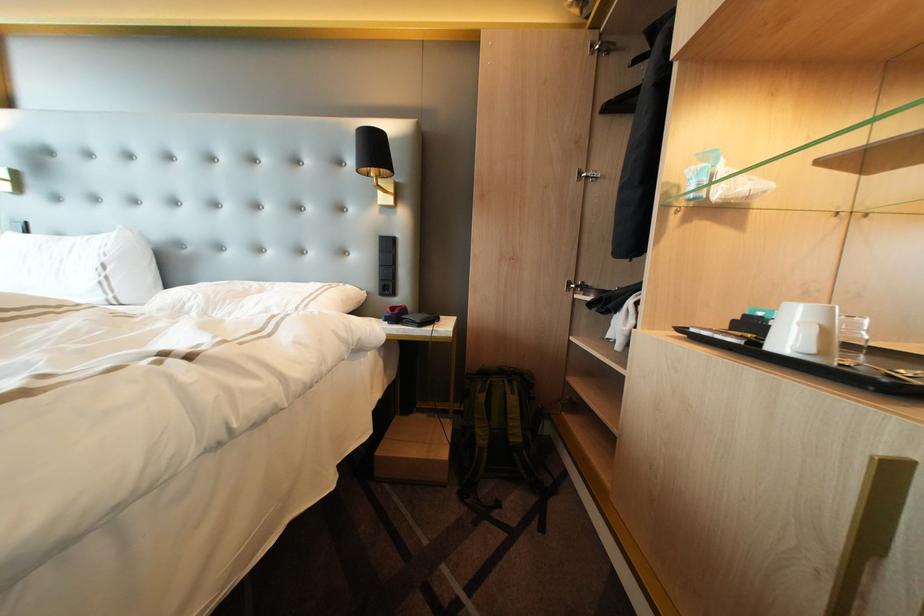
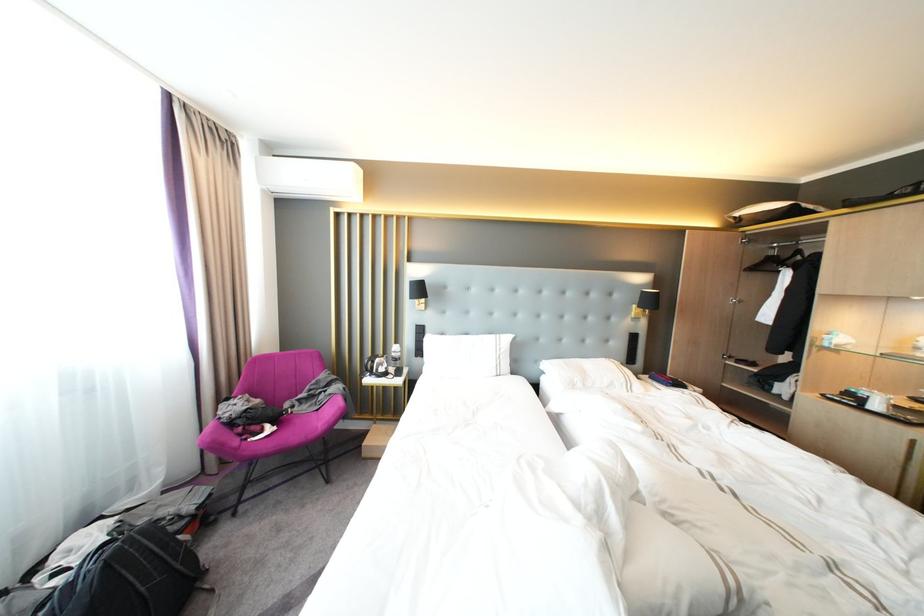
In a continuous first-person perspective shot, in which direction is the camera moving?

The cameraman moved toward left, backward.